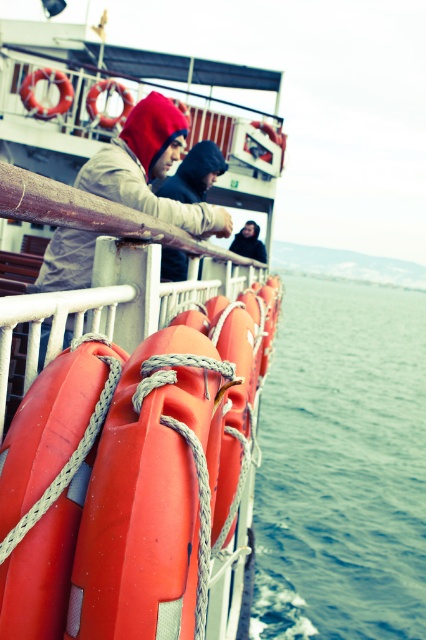
Question: Where is rubber lifebuoys at center located in relation to matte beige hoodie at center in the image?

Choices:
 (A) right
 (B) left

Answer: (B)

Question: Is blue water at lower right above matte beige hoodie at center?

Choices:
 (A) no
 (B) yes

Answer: (B)

Question: Is rubber lifebuoys at center positioned before matte gray hoodie at upper left?

Choices:
 (A) yes
 (B) no

Answer: (A)

Question: Which point is closer to the camera taking this photo?

Choices:
 (A) (244, 248)
 (B) (379, 324)
 (C) (147, 461)
 (D) (184, 221)

Answer: (C)

Question: Which object appears closest to the camera in this image?

Choices:
 (A) matte gray hoodie at upper left
 (B) blue water at lower right
 (C) rubber lifebuoys at center
 (D) dark gray hoodie at center

Answer: (C)

Question: Estimate the real-world distances between objects in this image. Which object is closer to the rubber lifebuoys at center?

Choices:
 (A) matte beige hoodie at center
 (B) dark gray hoodie at center

Answer: (A)